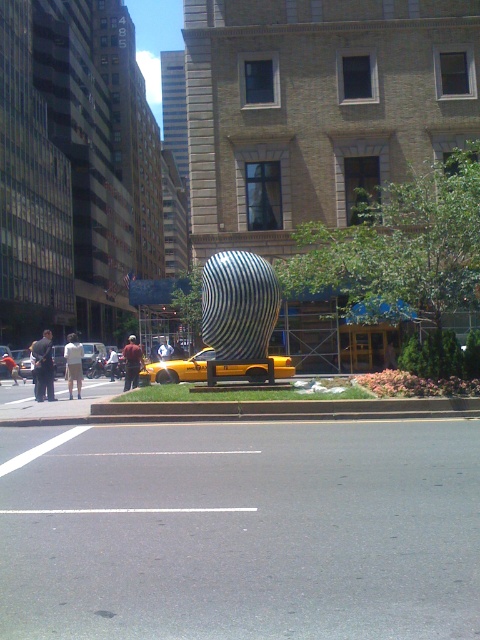
Can you confirm if dark brown leather jacket at center is positioned to the left of dark gray pants at center?

In fact, dark brown leather jacket at center is to the right of dark gray pants at center.

Who is positioned more to the left, dark brown leather jacket at center or dark gray pants at center?

dark gray pants at center

Does point (133, 387) lie behind point (111, 349)?

No, (133, 387) is closer to viewer.

Where is `dark brown leather jacket at center`? dark brown leather jacket at center is located at coordinates (132, 362).

Looking at this image, does dark brown leather jacket at center appear over white cotton shirt at center?

Actually, dark brown leather jacket at center is below white cotton shirt at center.

Which is behind, point (129, 340) or point (165, 342)?

The point (129, 340) is behind.

Identify the location of dark brown leather jacket at center. This screenshot has width=480, height=640. (132, 362).

Is dark gray jacket at left positioned at the back of white cotton shirt at center?

No, it is in front of white cotton shirt at center.

Can you confirm if dark gray jacket at left is positioned above white cotton shirt at center?

Yes.

Between point (40, 380) and point (158, 348), which one is positioned in front?

Point (40, 380) is more forward.

At what (x,y) coordinates should I click in order to perform the action: click on dark gray jacket at left. Please return your answer as a coordinate pair (x, y). This screenshot has height=640, width=480. Looking at the image, I should click on (44, 365).